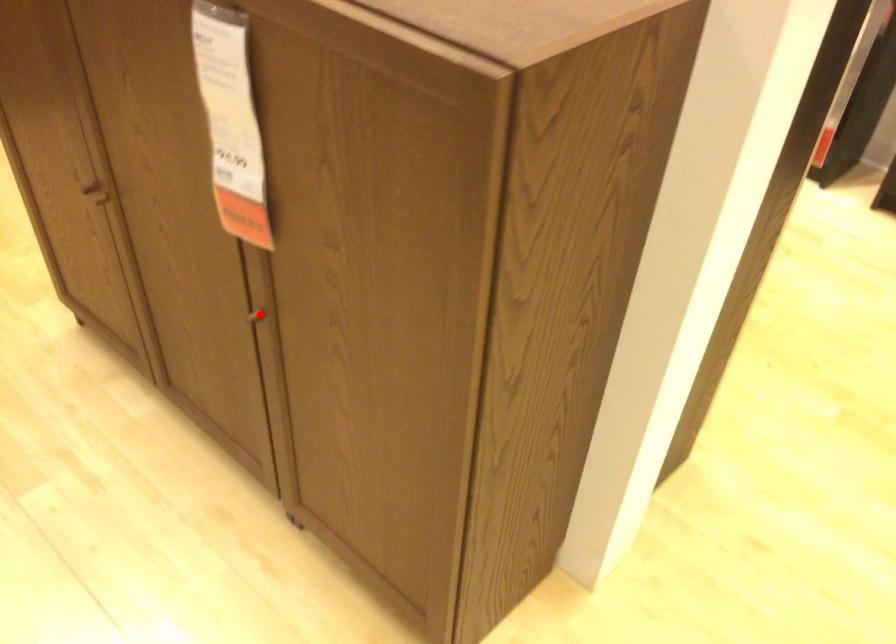
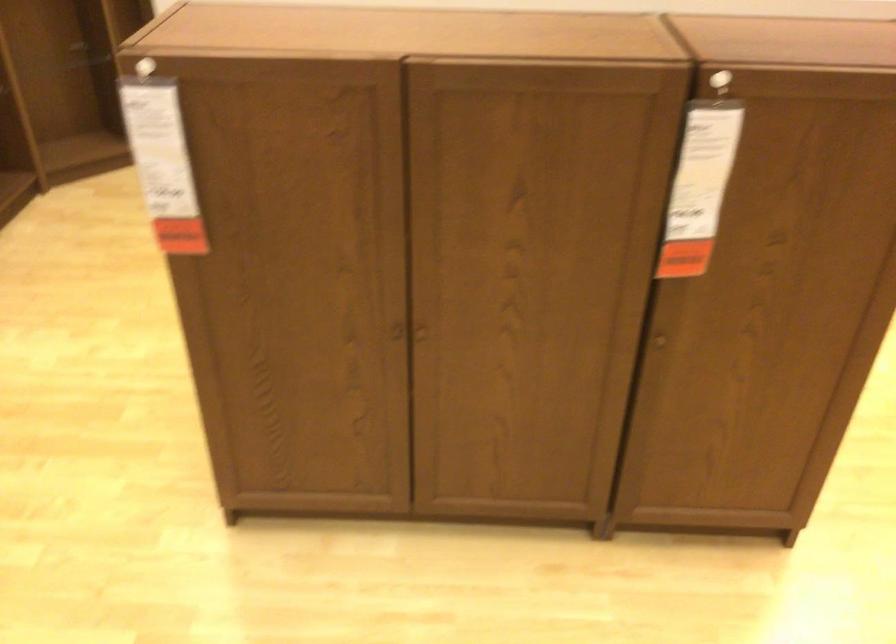
Question: A red point is marked in image1. In image2, is the corresponding 3D point closer to the camera or farther? Reply with the corresponding letter.

Choices:
 (A) The corresponding 3D point is closer.
 (B) The corresponding 3D point is farther.

Answer: (B)